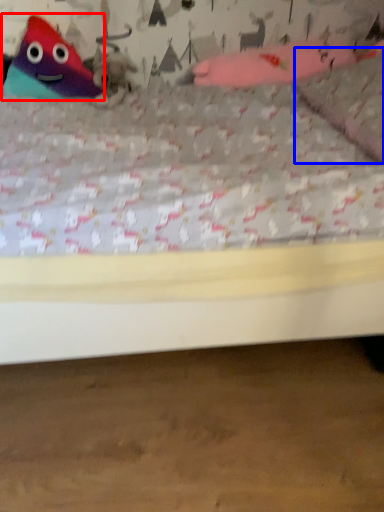
Question: Which object appears farthest to the camera in this image, toy (highlighted by a red box) or pillow (highlighted by a blue box)?

Choices:
 (A) toy
 (B) pillow

Answer: (A)